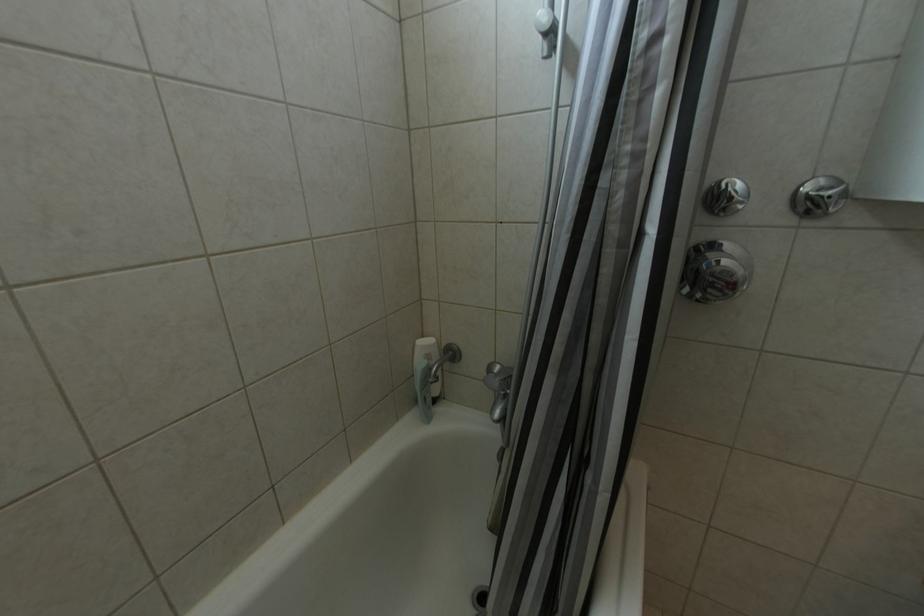
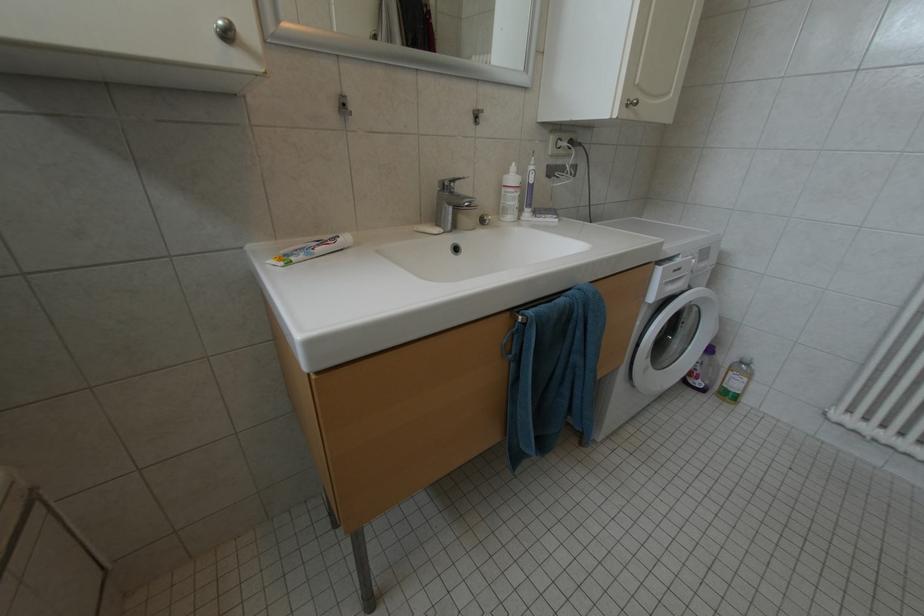
The first image is from the beginning of the video and the second image is from the end. How did the camera likely rotate when shooting the video?

The camera rotated toward right-down.